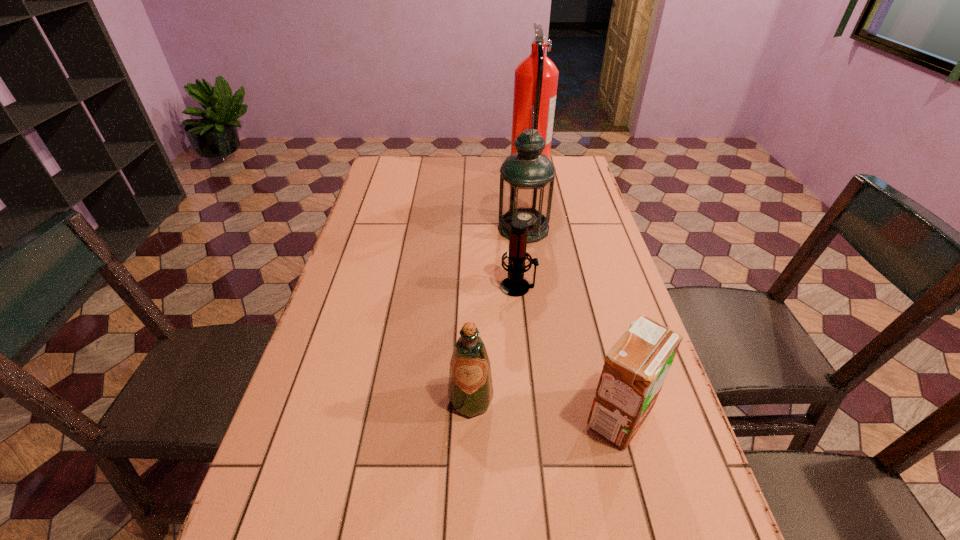
In the image, there is a desktop. Where is `vacant area at the far edge`? This screenshot has height=540, width=960. vacant area at the far edge is located at coordinates (498, 171).

Find the location of a particular element. The height and width of the screenshot is (540, 960). blank area at the left edge is located at coordinates (257, 502).

I want to click on vacant area at the right edge of the desktop, so click(x=573, y=268).

Where is `free spot between the carton and the olive oil`? free spot between the carton and the olive oil is located at coordinates (545, 408).

Where is `vacant point located between the leftmost object and the microphone`? This screenshot has width=960, height=540. vacant point located between the leftmost object and the microphone is located at coordinates (494, 343).

Find the location of a particular element. free space between the tallest object and the carton is located at coordinates [574, 293].

Image resolution: width=960 pixels, height=540 pixels. Find the location of `vacant area that lies between the carton and the third nearest object`. vacant area that lies between the carton and the third nearest object is located at coordinates [568, 352].

This screenshot has height=540, width=960. What are the coordinates of `free space between the leftmost object and the farthest object` in the screenshot? It's located at (500, 285).

Locate an element on the screen. The width and height of the screenshot is (960, 540). object that can be found as the third closest to the leftmost object is located at coordinates (527, 177).

You are a GUI agent. You are given a task and a screenshot of the screen. Output one action in this format:
    pyautogui.click(x=<x>, y=<y>)
    Task: Click on the object that can be found as the third closest to the third farthest object
    The image size is (960, 540).
    Given the screenshot: What is the action you would take?
    pyautogui.click(x=635, y=369)